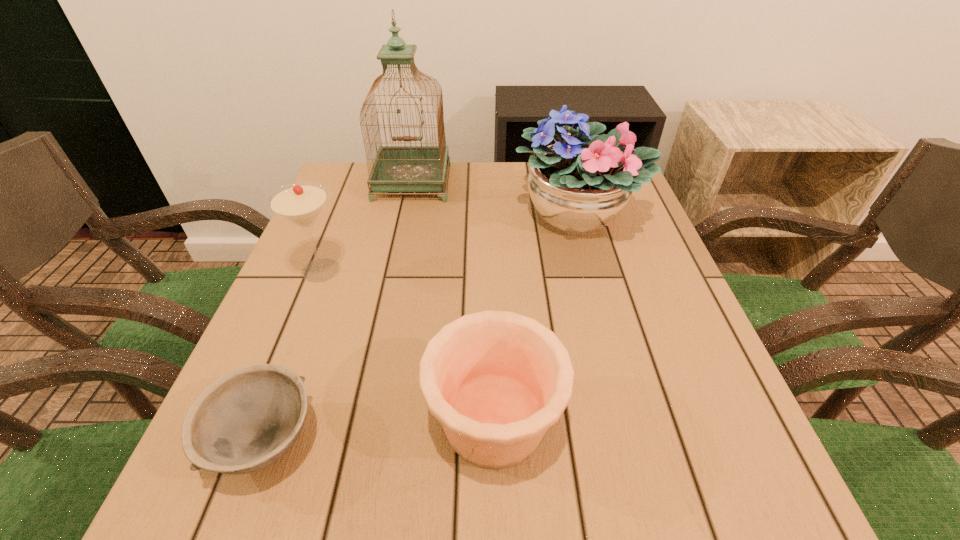
Where is `birdcage that is positioned at the far edge`? The width and height of the screenshot is (960, 540). birdcage that is positioned at the far edge is located at coordinates (404, 168).

Where is `bouquet that is at the far edge`? bouquet that is at the far edge is located at coordinates (579, 185).

Identify the location of pottery that is at the near edge. (496, 380).

Find the location of a particular element. This screenshot has height=540, width=960. bowl that is positioned at the near edge is located at coordinates (246, 420).

This screenshot has height=540, width=960. I want to click on birdcage at the left edge, so click(x=404, y=168).

Locate an element on the screen. The image size is (960, 540). martini that is at the left edge is located at coordinates (300, 203).

The height and width of the screenshot is (540, 960). Find the location of `bowl located in the left edge section of the desktop`. bowl located in the left edge section of the desktop is located at coordinates click(246, 420).

In order to click on object present at the right edge in this screenshot , I will do `click(579, 185)`.

Find the location of a particular element. object that is positioned at the far left corner is located at coordinates (404, 168).

Image resolution: width=960 pixels, height=540 pixels. In order to click on object positioned at the near left corner in this screenshot , I will do click(x=246, y=420).